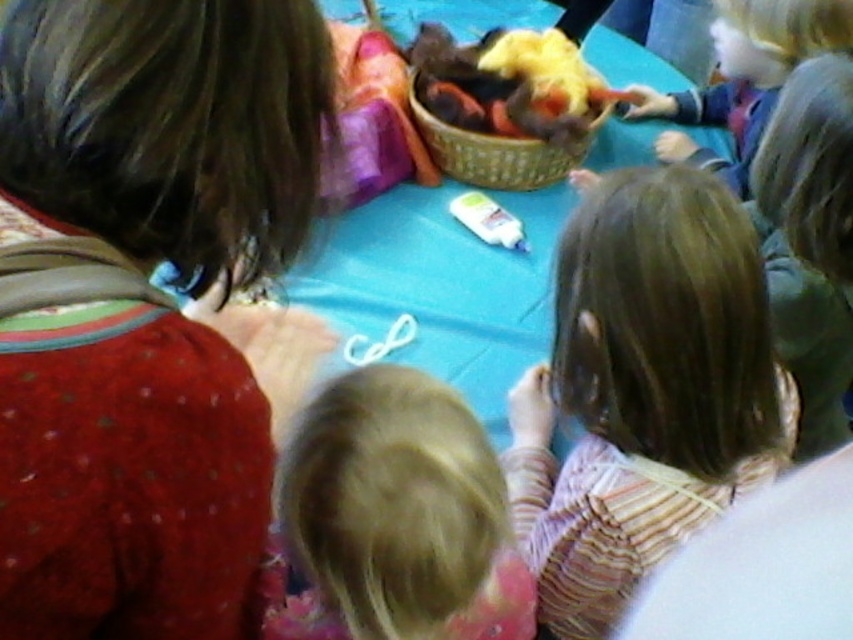
Question: Can you confirm if bright yellow yarn at upper center is bigger than white glossy glue at center?

Choices:
 (A) yes
 (B) no

Answer: (A)

Question: Does light brown hair at center have a lesser width compared to white glossy glue at center?

Choices:
 (A) yes
 (B) no

Answer: (B)

Question: Which point is farther to the camera?

Choices:
 (A) matte red sweater at left
 (B) white glossy glue at center

Answer: (B)

Question: Which object appears closest to the camera in this image?

Choices:
 (A) white glossy glue at center
 (B) blonde hair at center
 (C) blue fabric table at center

Answer: (B)

Question: Which object is farther from the camera taking this photo?

Choices:
 (A) brown woven basket at center
 (B) light brown hair at center

Answer: (A)

Question: Can you confirm if matte red sweater at left is positioned to the right of blonde hair at center?

Choices:
 (A) yes
 (B) no

Answer: (B)